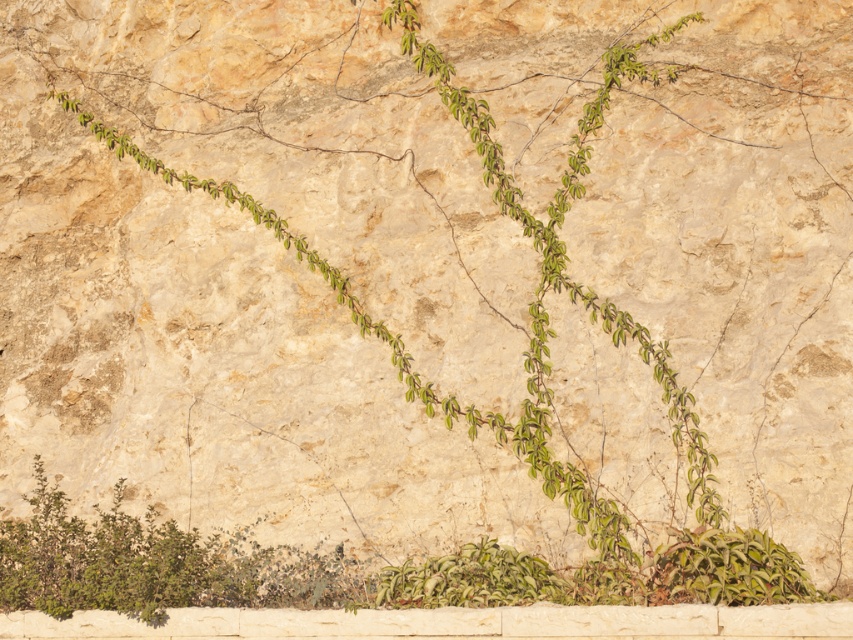
Which is more to the left, green leafy bush at lower left or green leafy plant at lower right?

Positioned to the left is green leafy bush at lower left.

Based on the photo, can you confirm if green leafy bush at lower left is positioned to the left of green leafy plant at lower right?

Indeed, green leafy bush at lower left is positioned on the left side of green leafy plant at lower right.

Locate an element on the screen. This screenshot has width=853, height=640. green leafy bush at lower left is located at coordinates (154, 563).